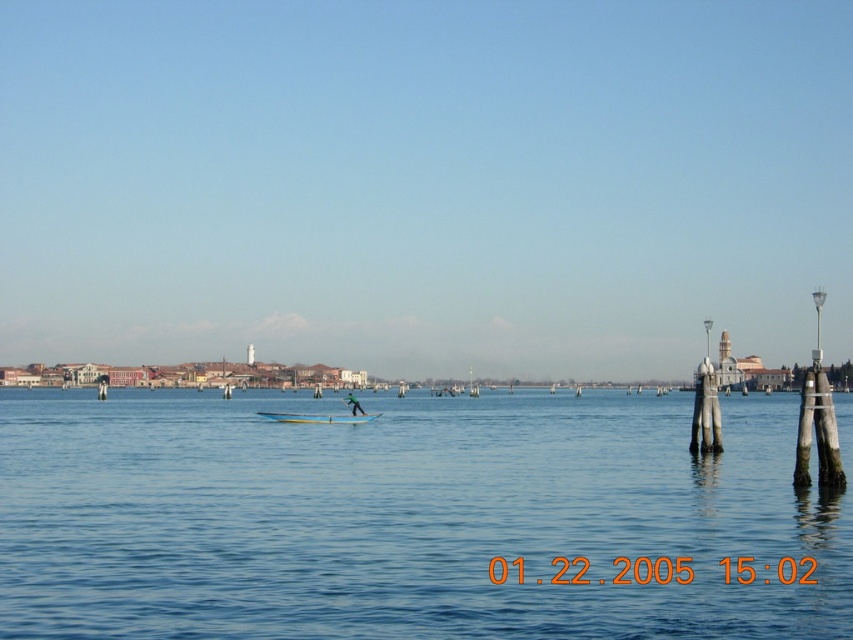
Question: Which point is closer to the camera taking this photo?

Choices:
 (A) (354, 408)
 (B) (432, 432)

Answer: (A)

Question: Does blue water at center have a greater width compared to white glossy canoe at center?

Choices:
 (A) yes
 (B) no

Answer: (A)

Question: Based on their relative distances, which object is nearer to the green fabric person at center?

Choices:
 (A) blue water at center
 (B) white glossy canoe at center

Answer: (B)

Question: Where is white glossy canoe at center located in relation to green fabric person at center in the image?

Choices:
 (A) left
 (B) right

Answer: (B)

Question: Estimate the real-world distances between objects in this image. Which object is farther from the white glossy canoe at center?

Choices:
 (A) blue water at center
 (B) green fabric person at center

Answer: (A)

Question: Is blue water at center in front of green fabric person at center?

Choices:
 (A) yes
 (B) no

Answer: (A)